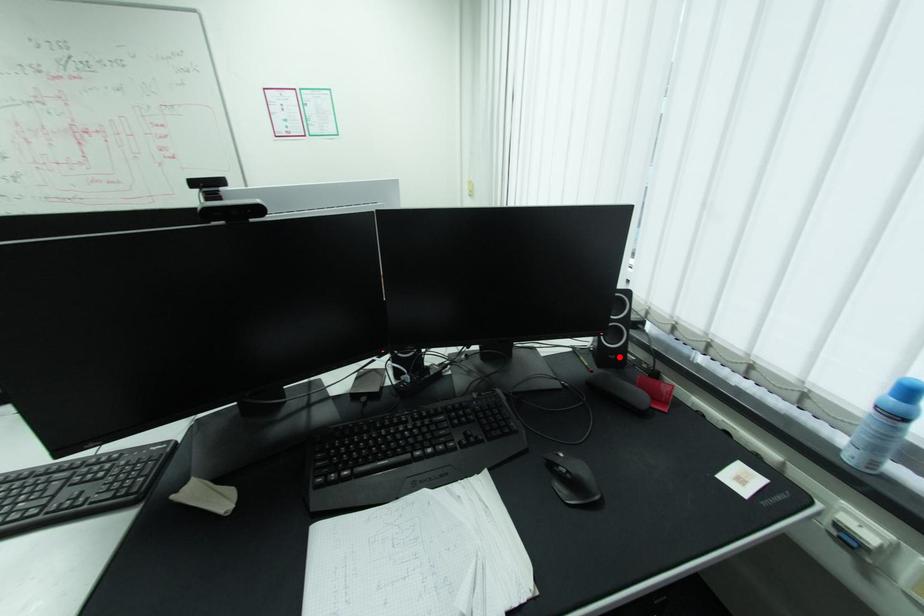
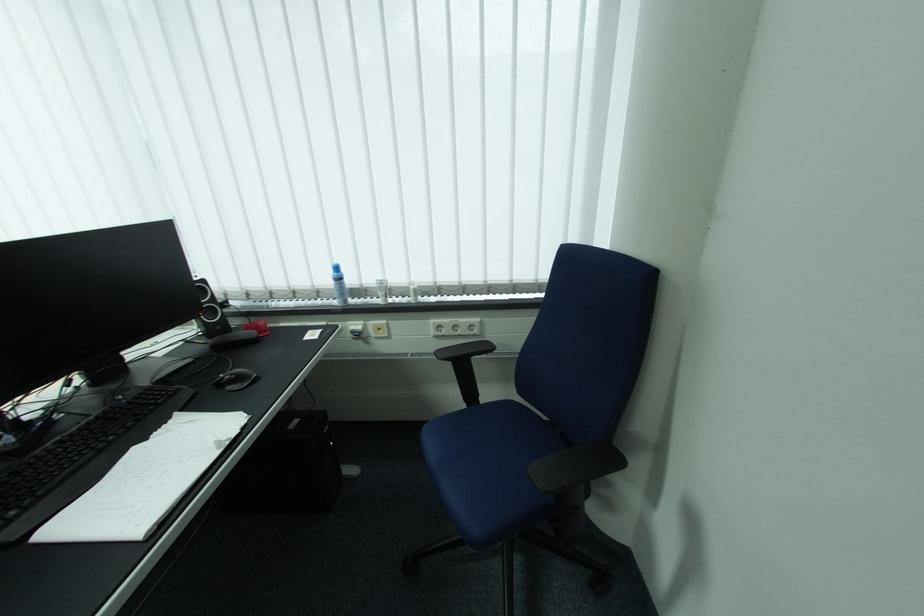
Where in the second image is the point corresponding to the highlighted location from the first image?

(225, 328)